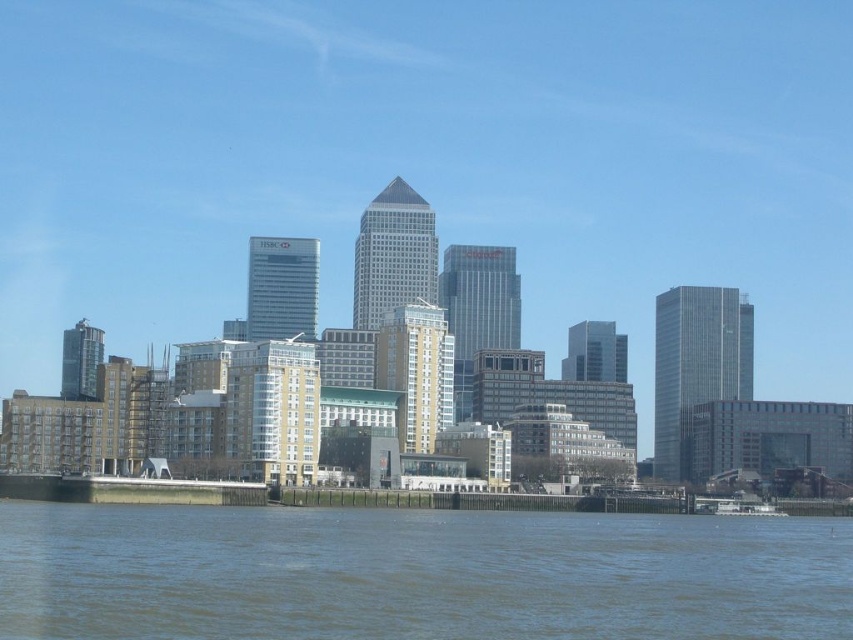
Is brown water at lower center to the right of white matte boat at lower right from the viewer's perspective?

No, brown water at lower center is not to the right of white matte boat at lower right.

Is point (437, 572) positioned in front of point (727, 509)?

Yes, point (437, 572) is closer to viewer.

Where is `brown water at lower center`? brown water at lower center is located at coordinates (416, 573).